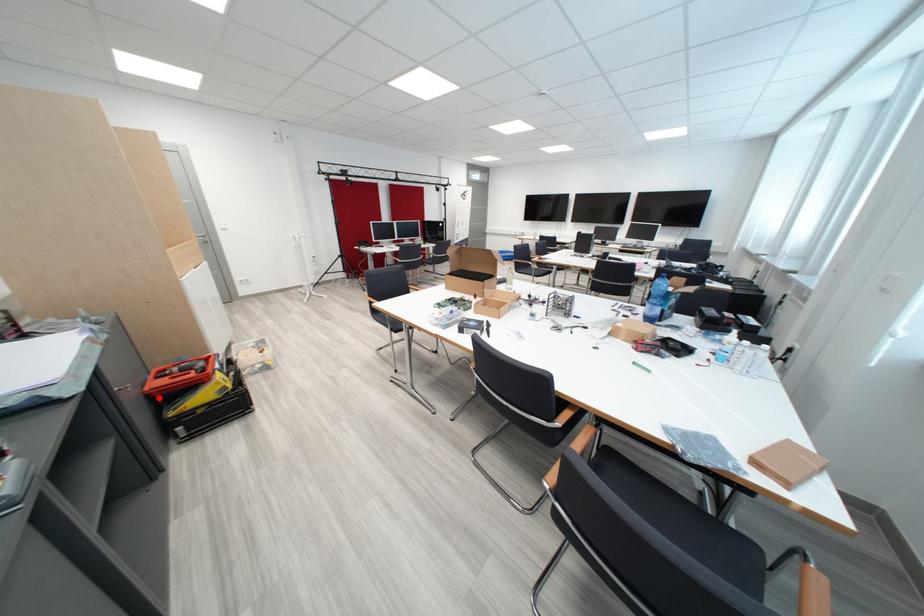
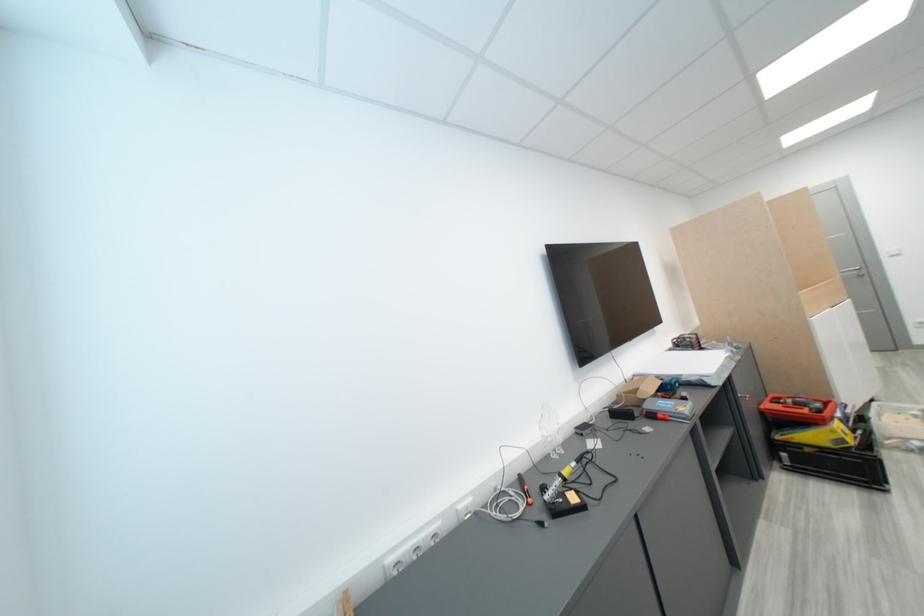
Where in the second image is the point corresponding to the highlighted location from the first image?

(772, 416)